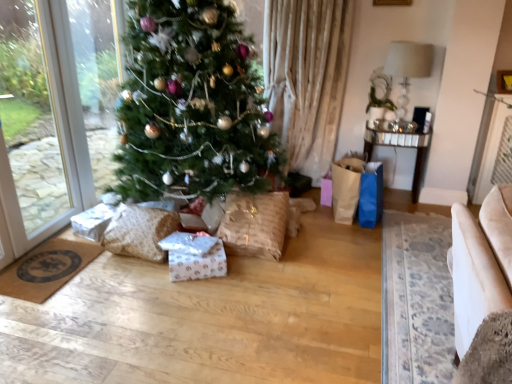
In order to face textured beige pillow at lower left, the second pillow from the right, should I rotate leftwards or rightwards?

To face it directly, rotate left by 15.204 degrees.

Describe the element at coordinates (139, 231) in the screenshot. The height and width of the screenshot is (384, 512). I see `textured beige pillow at lower left, the second pillow from the right` at that location.

In order to face mirrored glass table at right, should I rotate leftwards or rightwards?

It's best to rotate right around 17.873 degrees.

Locate an element on the screen. white fabric lampshade at upper right is located at coordinates (408, 68).

Considering the sizes of mirrored glass table at right and white fabric lampshade at upper right in the image, is mirrored glass table at right wider or thinner than white fabric lampshade at upper right?

mirrored glass table at right is wider than white fabric lampshade at upper right.

From the picture: Would you say mirrored glass table at right is a long distance from white fabric lampshade at upper right?

They are positioned close to each other.

From a real-world perspective, is mirrored glass table at right physically below white fabric lampshade at upper right?

Correct, in the physical world, mirrored glass table at right is lower than white fabric lampshade at upper right.

Does mirrored glass table at right appear on the right side of white fabric lampshade at upper right?

No, mirrored glass table at right is not to the right of white fabric lampshade at upper right.

Could you tell me if beige fabric armchair at lower right is facing green matte christmas tree at center?

No.

This screenshot has width=512, height=384. Identify the location of armchair that appears on the right of green matte christmas tree at center. pyautogui.click(x=481, y=263).

Which of these two, beige fabric armchair at lower right or green matte christmas tree at center, is smaller?

With smaller size is beige fabric armchair at lower right.

Which of these two, beige fabric armchair at lower right or green matte christmas tree at center, is thinner?

With smaller width is green matte christmas tree at center.

Considering the sizes of white glossy paper at center and green matte christmas tree at center in the image, is white glossy paper at center wider or thinner than green matte christmas tree at center?

Considering their sizes, white glossy paper at center looks slimmer than green matte christmas tree at center.

Is the depth of white glossy paper at center greater than that of green matte christmas tree at center?

That is True.

Choose the correct answer: Is white glossy paper at center inside green matte christmas tree at center or outside it?

white glossy paper at center lies outside green matte christmas tree at center.

From the image's perspective, is white glossy paper at center above green matte christmas tree at center?

Incorrect, from the image's perspective, white glossy paper at center is lower than green matte christmas tree at center.

Can you confirm if burlap wrapped gift at center, the 2th pillow when ordered from left to right, is wider than textured beige pillow at lower left, the second pillow from the right?

Yes.

Is burlap wrapped gift at center, the 1th pillow viewed from the right, to the left of textured beige pillow at lower left, the second pillow from the right, from the viewer's perspective?

Incorrect, burlap wrapped gift at center, the 1th pillow viewed from the right, is not on the left side of textured beige pillow at lower left, the second pillow from the right.

From a real-world perspective, which object rests below the other?

textured beige pillow at lower left, the 1th pillow when ordered from left to right, is physically lower.

Which is closer to the camera, (267, 229) or (178, 218)?

Positioned in front is point (267, 229).

Can you confirm if white fabric lampshade at upper right is shorter than beige fabric armchair at lower right?

No, white fabric lampshade at upper right is not shorter than beige fabric armchair at lower right.

In the scene shown: Are white fabric lampshade at upper right and beige fabric armchair at lower right making contact?

No, white fabric lampshade at upper right is not making contact with beige fabric armchair at lower right.

The height and width of the screenshot is (384, 512). I want to click on armchair in front of the white fabric lampshade at upper right, so click(x=481, y=263).

Is white fabric lampshade at upper right turned away from beige fabric armchair at lower right?

That's not correct — white fabric lampshade at upper right is not looking away from beige fabric armchair at lower right.

From the image's perspective, which object appears higher, textured beige pillow at lower left, the second pillow from the right, or white fabric lampshade at upper right?

From the image's view, white fabric lampshade at upper right is above.

Does textured beige pillow at lower left, the 1th pillow when ordered from left to right, have a greater height compared to white fabric lampshade at upper right?

No, textured beige pillow at lower left, the 1th pillow when ordered from left to right, is not taller than white fabric lampshade at upper right.

Consider the image. From a real-world perspective, which object stands above the other?

white fabric lampshade at upper right.

Is textured beige pillow at lower left, the 1th pillow when ordered from left to right, positioned before white fabric lampshade at upper right?

That is True.

Is point (429, 54) closer to camera compared to point (236, 58)?

No, it is not.

Image resolution: width=512 pixels, height=384 pixels. I want to click on christmas tree located on the left of white fabric lampshade at upper right, so pyautogui.click(x=192, y=105).

Can you tell me how much white fabric lampshade at upper right and green matte christmas tree at center differ in facing direction?

91.5 degrees.

Based on the photo, is white fabric lampshade at upper right bigger than green matte christmas tree at center?

Actually, white fabric lampshade at upper right might be smaller than green matte christmas tree at center.

Identify the location of table behind the white fabric lampshade at upper right. (401, 147).

You are a GUI agent. You are given a task and a screenshot of the screen. Output one action in this format:
    pyautogui.click(x=<x>, y=<y>)
    Task: Click on the armchair beneath the green matte christmas tree at center (from a real-world perspective)
    The height and width of the screenshot is (384, 512).
    Given the screenshot: What is the action you would take?
    pyautogui.click(x=481, y=263)

Based on their spatial positions, is mirrored glass table at right or burlap wrapped gift at center, the 2th pillow when ordered from left to right, closer to textured beige pillow at lower left, the 1th pillow when ordered from left to right?

burlap wrapped gift at center, the 2th pillow when ordered from left to right, is positioned closer to the anchor textured beige pillow at lower left, the 1th pillow when ordered from left to right.

Looking at the image, which one is located closer to beige fabric armchair at lower right, textured beige pillow at lower left, the second pillow from the right, or white fabric lampshade at upper right?

Based on the image, textured beige pillow at lower left, the second pillow from the right, appears to be nearer to beige fabric armchair at lower right.

Estimate the real-world distances between objects in this image. Which object is further from white fabric lampshade at upper right, green matte christmas tree at center or textured beige pillow at lower left, the 1th pillow when ordered from left to right?

Among the two, textured beige pillow at lower left, the 1th pillow when ordered from left to right, is located further to white fabric lampshade at upper right.

Estimate the real-world distances between objects in this image. Which object is further from mirrored glass table at right, textured beige pillow at lower left, the 1th pillow when ordered from left to right, or white glossy paper at center?

Based on the image, textured beige pillow at lower left, the 1th pillow when ordered from left to right, appears to be further to mirrored glass table at right.

Based on their spatial positions, is white glossy paper at center or green matte christmas tree at center further from mirrored glass table at right?

Among the two, white glossy paper at center is located further to mirrored glass table at right.

Which object lies nearer to the anchor point white fabric lampshade at upper right, burlap wrapped gift at center, the 2th pillow when ordered from left to right, or mirrored glass table at right?

Based on the image, mirrored glass table at right appears to be nearer to white fabric lampshade at upper right.

Which object lies nearer to the anchor point mirrored glass table at right, white fabric lampshade at upper right or burlap wrapped gift at center, the 1th pillow viewed from the right?

white fabric lampshade at upper right.

Which object lies nearer to the anchor point mirrored glass table at right, white glossy paper at center or textured beige pillow at lower left, the 1th pillow when ordered from left to right?

white glossy paper at center is closer to mirrored glass table at right.

The height and width of the screenshot is (384, 512). What are the coordinates of `table situated between burlap wrapped gift at center, the 1th pillow viewed from the right, and white fabric lampshade at upper right from left to right` in the screenshot? It's located at (401, 147).

This screenshot has height=384, width=512. Identify the location of pillow between green matte christmas tree at center and mirrored glass table at right in the horizontal direction. (255, 224).

At what (x,y) coordinates should I click in order to perform the action: click on table between textured beige pillow at lower left, the 1th pillow when ordered from left to right, and beige fabric armchair at lower right, in the horizontal direction. Please return your answer as a coordinate pair (x, y). The width and height of the screenshot is (512, 384). Looking at the image, I should click on (401, 147).

Where is `christmas tree situated between textured beige pillow at lower left, the 1th pillow when ordered from left to right, and mirrored glass table at right from left to right`? The width and height of the screenshot is (512, 384). christmas tree situated between textured beige pillow at lower left, the 1th pillow when ordered from left to right, and mirrored glass table at right from left to right is located at coordinates (192, 105).